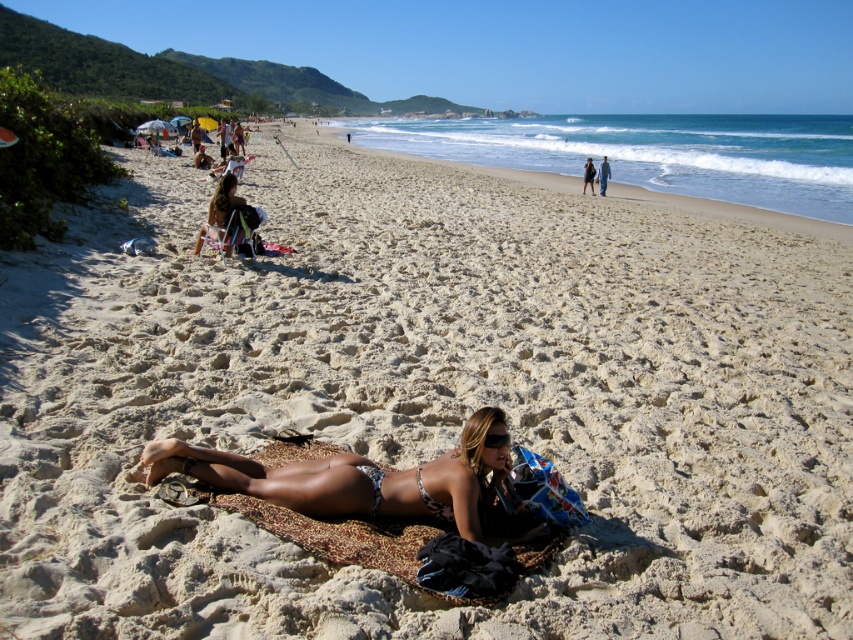
Looking at this image, you are a photographer trying to capture the leopard print fabric at center and the blue denim jeans at center in the same frame. Which object should you focus on first if you want to include both in your shot without zooming in or out?

The leopard print fabric at center has a smaller size compared to blue denim jeans at center, so you should focus on the leopard print fabric at center first to ensure it fits within the frame while also capturing the larger blue denim jeans at center.

You are standing on the beach and see the dark blue fabric bag at center and the blue denim jeans at center. Which one is closer to you?

The dark blue fabric bag at center is closer to you because it is further to the viewer than the blue denim jeans at center.